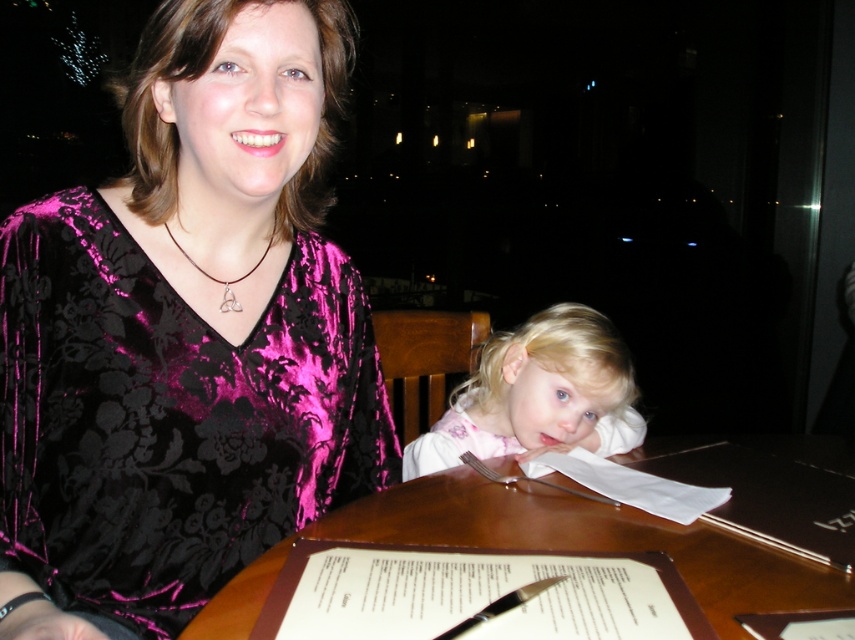
How much distance is there between wooden table at center and white paper menu at center?

→ The distance of wooden table at center from white paper menu at center is 11.87 centimeters.

Consider the image. Is wooden table at center wider than white paper menu at center?

Indeed, wooden table at center has a greater width compared to white paper menu at center.

Which is in front, point (258, 576) or point (668, 564)?

Positioned in front is point (258, 576).

Locate an element on the screen. The height and width of the screenshot is (640, 855). wooden table at center is located at coordinates (593, 541).

Does white paper menu at center appear under matte pink shirt at center?

Yes.

Consider the image. Does white paper menu at center have a lesser width compared to matte pink shirt at center?

Indeed, white paper menu at center has a lesser width compared to matte pink shirt at center.

I want to click on white paper menu at center, so click(x=475, y=595).

In the scene shown: Does velvet/black dress at center have a lesser width compared to gold metallic pendant at center?

No, velvet/black dress at center is not thinner than gold metallic pendant at center.

The height and width of the screenshot is (640, 855). I want to click on velvet/black dress at center, so click(x=186, y=336).